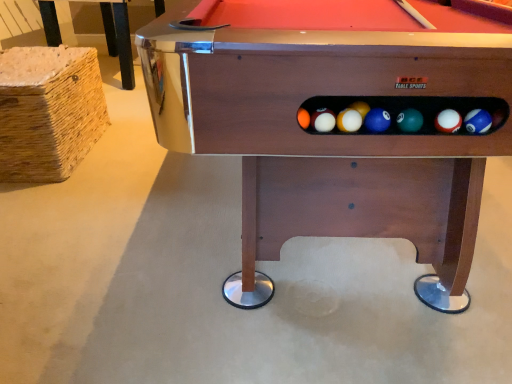
Question: Is wooden billiard table at center turned away from shiny metallic pool table at upper left?

Choices:
 (A) yes
 (B) no

Answer: (B)

Question: From the image's perspective, is wooden billiard table at center on top of shiny metallic pool table at upper left?

Choices:
 (A) yes
 (B) no

Answer: (B)

Question: Can you see wooden billiard table at center touching shiny metallic pool table at upper left?

Choices:
 (A) no
 (B) yes

Answer: (A)

Question: Is there a large distance between wooden billiard table at center and shiny metallic pool table at upper left?

Choices:
 (A) yes
 (B) no

Answer: (A)

Question: From the image's perspective, is wooden billiard table at center beneath shiny metallic pool table at upper left?

Choices:
 (A) yes
 (B) no

Answer: (A)

Question: Is wooden billiard table at center thinner than shiny metallic pool table at upper left?

Choices:
 (A) no
 (B) yes

Answer: (B)

Question: Considering the relative positions of shiny metallic pool table at upper left and wooden billiard table at center in the image provided, is shiny metallic pool table at upper left to the left of wooden billiard table at center from the viewer's perspective?

Choices:
 (A) yes
 (B) no

Answer: (A)

Question: From the image's perspective, is shiny metallic pool table at upper left on wooden billiard table at center?

Choices:
 (A) yes
 (B) no

Answer: (A)

Question: Is shiny metallic pool table at upper left beside wooden billiard table at center?

Choices:
 (A) no
 (B) yes

Answer: (A)

Question: Is shiny metallic pool table at upper left smaller than wooden billiard table at center?

Choices:
 (A) no
 (B) yes

Answer: (B)

Question: Considering the relative sizes of shiny metallic pool table at upper left and wooden billiard table at center in the image provided, is shiny metallic pool table at upper left bigger than wooden billiard table at center?

Choices:
 (A) yes
 (B) no

Answer: (B)

Question: Is shiny metallic pool table at upper left far away from wooden billiard table at center?

Choices:
 (A) no
 (B) yes

Answer: (B)

Question: Would you say wooden billiard table at center is inside or outside shiny metallic pool table at upper left?

Choices:
 (A) outside
 (B) inside

Answer: (A)